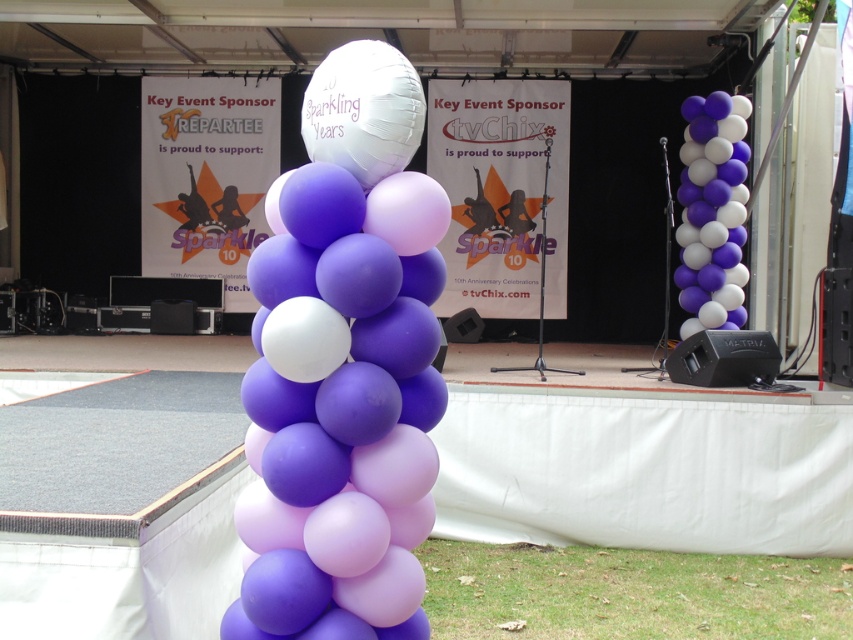
Can you confirm if matte purple balloons at center is positioned to the right of purple matte balloons at right?

No, matte purple balloons at center is not to the right of purple matte balloons at right.

Does point (257, 560) lie behind point (732, 298)?

No, (257, 560) is closer to viewer.

Who is more forward, (421, 513) or (692, 218)?

→ Point (421, 513)

At what (x,y) coordinates should I click in order to perform the action: click on matte purple balloons at center. Please return your answer as a coordinate pair (x, y). This screenshot has width=853, height=640. Looking at the image, I should click on (344, 368).